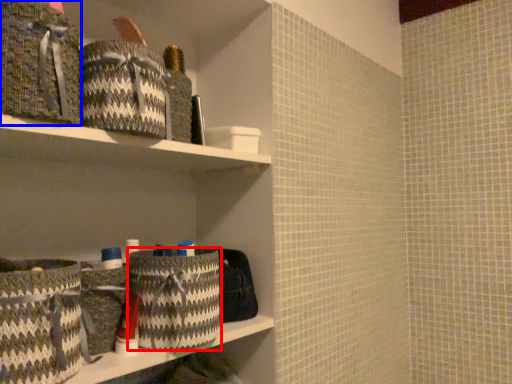
Question: Among these objects, which one is farthest to the camera, laundry basket (highlighted by a red box) or material (highlighted by a blue box)?

Choices:
 (A) laundry basket
 (B) material

Answer: (A)